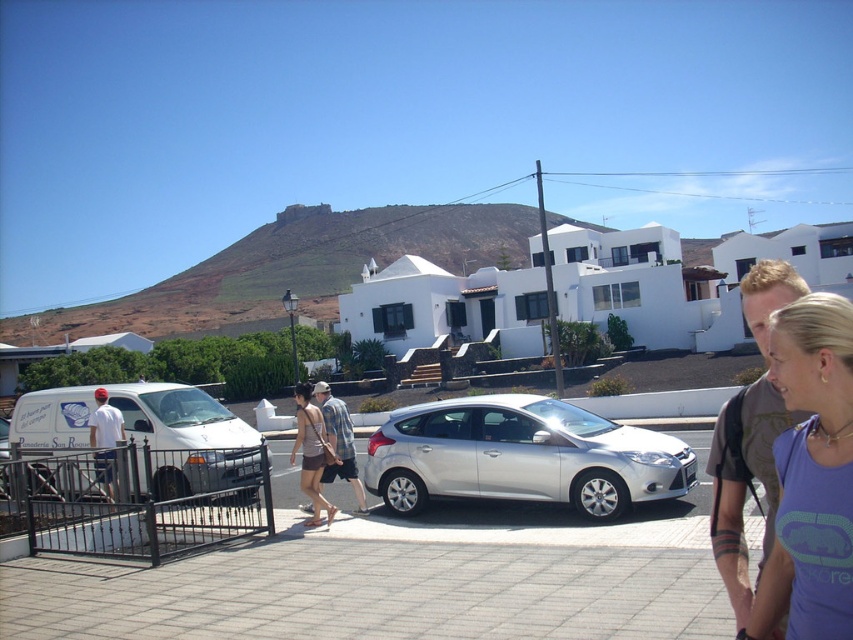
You are a delivery person who needs to park your silver metallic hatchback at center near the white matte shirt at left. Considering their sizes, will the hatchback fit in the space allocated for it without overlapping the shirt?

The silver metallic hatchback at center is smaller than the white matte shirt at left, so it should fit in the space without overlapping the shirt.

You are standing at the bottom of the steps leading to the building with the garden. You see two points marked in the image. One is at point (814, 588) and the other is at point (45, 412). Which point is closer to you?

Point (814, 588) is in front of point (45, 412), so it is closer to you.

You are standing in the foreground of the scene and want to reach the white matte shirt at left without going around the silver metallic hatchback at center. Is it possible to walk directly to the shirt?

The silver metallic hatchback at center is closer to the viewer than the white matte shirt at left, so the hatchback is blocking the direct path to the shirt. You would need to go around it to reach the shirt.